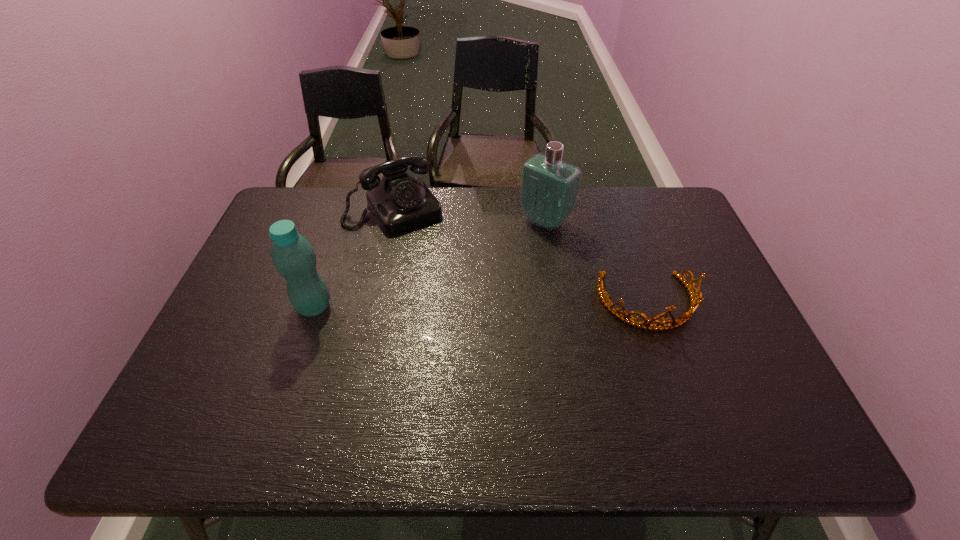
Where is `blank space located on the front label of the perfume`? blank space located on the front label of the perfume is located at coordinates (450, 305).

Find the location of a particular element. free space located 0.340m on the front label of the perfume is located at coordinates (460, 296).

Find the location of a particular element. free space located 0.240m on the dial of the telephone is located at coordinates (446, 279).

The height and width of the screenshot is (540, 960). Find the location of `vacant space situated 0.070m on the dial of the telephone`. vacant space situated 0.070m on the dial of the telephone is located at coordinates [422, 244].

At what (x,y) coordinates should I click in order to perform the action: click on vacant region located 0.370m on the dial of the telephone. Please return your answer as a coordinate pair (x, y). Looking at the image, I should click on (468, 309).

Locate an element on the screen. This screenshot has height=540, width=960. perfume positioned at the far edge is located at coordinates (549, 188).

Locate an element on the screen. telephone at the far edge is located at coordinates (399, 202).

Locate an element on the screen. object at the right edge is located at coordinates pyautogui.click(x=695, y=300).

Where is `vacant area at the far edge of the desktop`? Image resolution: width=960 pixels, height=540 pixels. vacant area at the far edge of the desktop is located at coordinates (343, 195).

The height and width of the screenshot is (540, 960). In order to click on vacant space at the near edge of the desktop in this screenshot , I will do `click(529, 374)`.